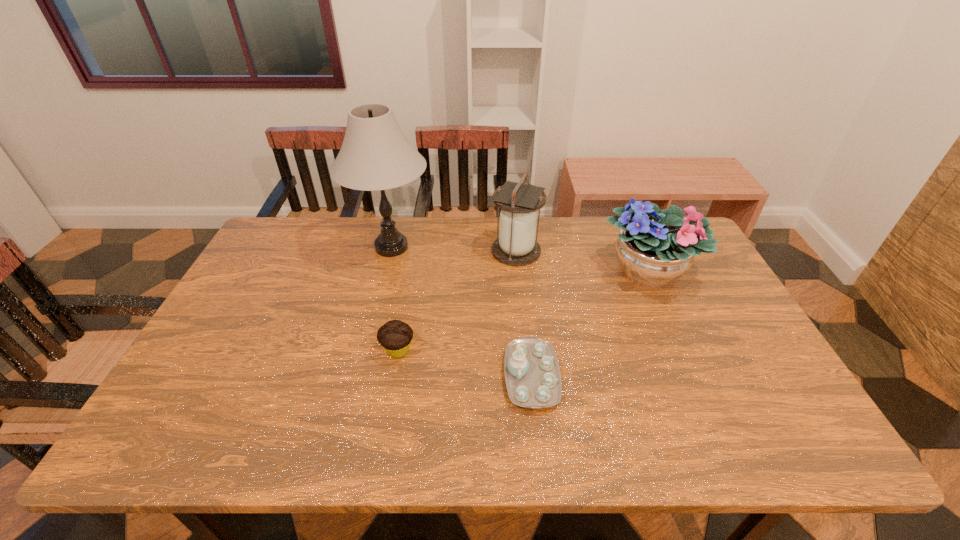
You are a GUI agent. You are given a task and a screenshot of the screen. Output one action in this format:
    pyautogui.click(x=<x>, y=<y>)
    Task: Click on the lamp situated at the far edge
    The image size is (960, 540).
    Given the screenshot: What is the action you would take?
    pyautogui.click(x=375, y=155)

Where is `lantern located at the far edge`? lantern located at the far edge is located at coordinates (519, 202).

The width and height of the screenshot is (960, 540). Find the location of `bouquet located at the far edge`. bouquet located at the far edge is located at coordinates (655, 247).

Identify the location of object that is positioned at the right edge. (655, 247).

Identify the location of object that is positioned at the far right corner. Image resolution: width=960 pixels, height=540 pixels. (655, 247).

In the image, there is a desktop. At what (x,y) coordinates should I click in order to perform the action: click on vacant space at the far edge. Please return your answer as a coordinate pair (x, y). The image size is (960, 540). Looking at the image, I should click on (607, 249).

The width and height of the screenshot is (960, 540). What are the coordinates of `vacant space at the near edge of the desktop` in the screenshot? It's located at (245, 448).

Locate an element on the screen. This screenshot has height=540, width=960. free spot at the right edge of the desktop is located at coordinates [x=751, y=367].

Find the location of a particular element. Image resolution: width=960 pixels, height=540 pixels. free region at the far left corner of the desktop is located at coordinates (275, 243).

You are a GUI agent. You are given a task and a screenshot of the screen. Output one action in this format:
    pyautogui.click(x=<x>, y=<y>)
    Task: Click on the free spot between the muffin and the lamp
    The image size is (960, 540).
    Given the screenshot: What is the action you would take?
    pyautogui.click(x=395, y=299)